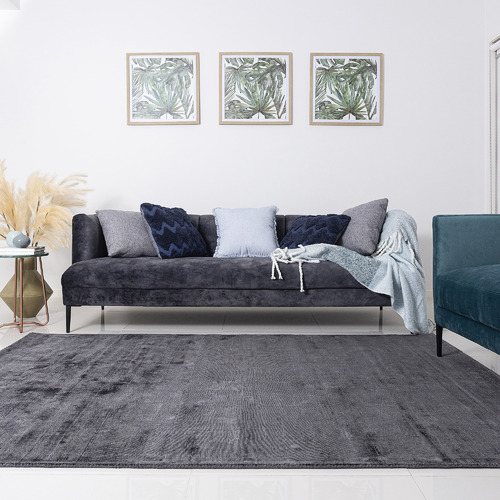
You are a GUI agent. You are given a task and a screenshot of the screen. Output one action in this format:
    pyautogui.click(x=<x>, y=<y>)
    Task: Click on the table
    Image resolution: width=500 pixels, height=500 pixels.
    Given the screenshot: What is the action you would take?
    click(19, 255)